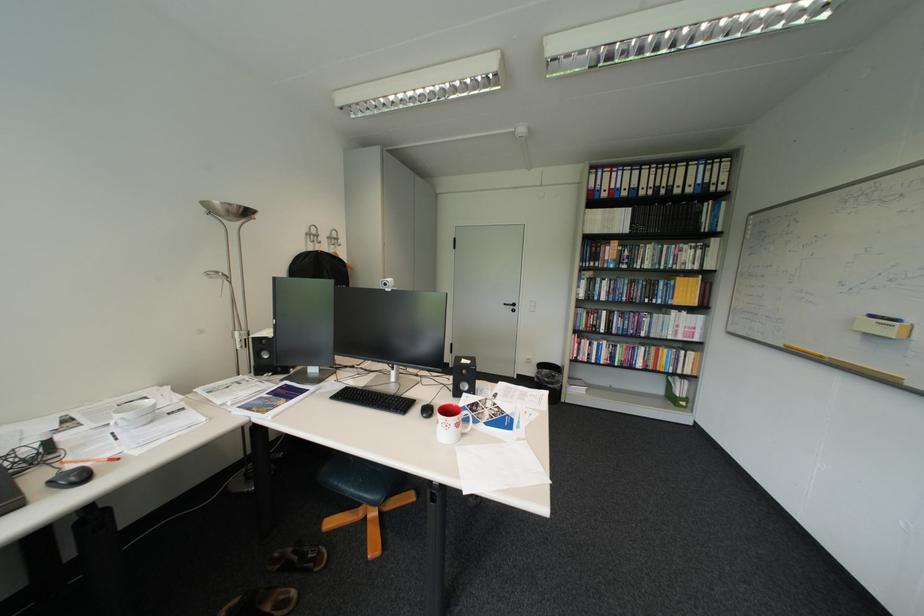
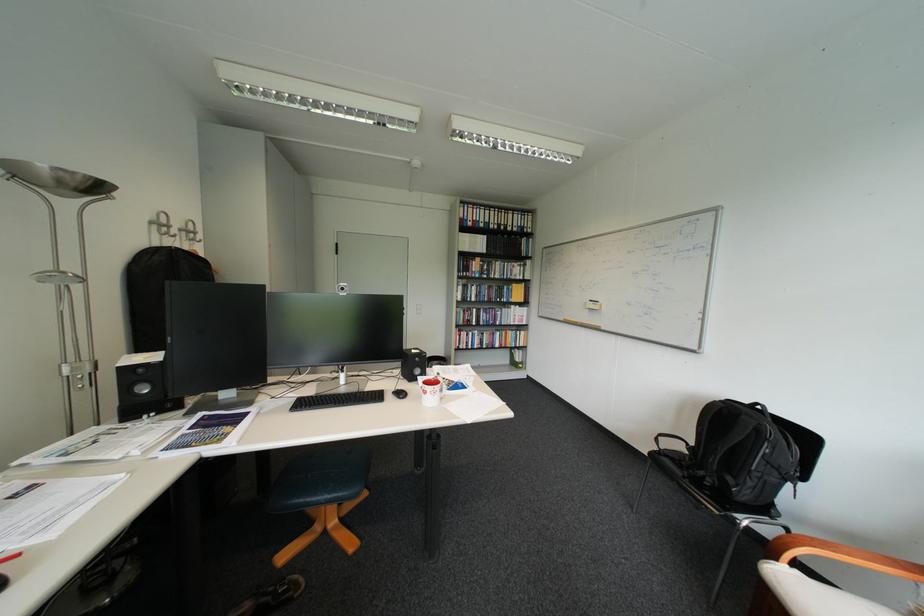
In the second image, find the point that corresponds to (347,484) in the first image.

(313, 501)